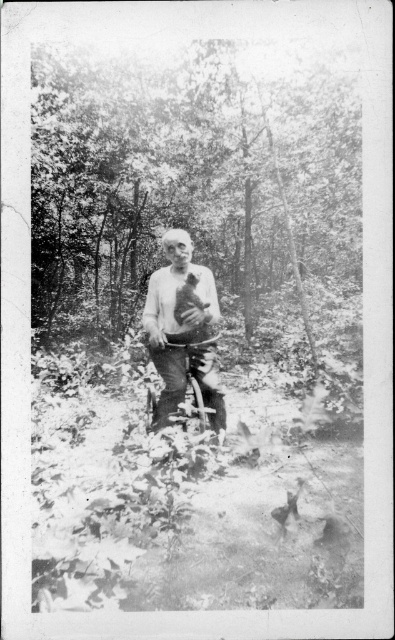
You are standing in the wooded area and see the smooth bark tree at center and the smooth white shirt at center. Which object is located to the right of the other?

The smooth bark tree at center is positioned on the right side of smooth white shirt at center, so the smooth bark tree at center is to the right of the smooth white shirt at center.

You are a photographer trying to capture a clear shot of the smooth white shirt at center. However, the smooth bark tree at center is blocking your view. Can you adjust your position to avoid the obstruction?

The smooth bark tree at center is positioned over the smooth white shirt at center, so moving your camera position downward might allow you to capture the smooth white shirt at center without the obstruction of the tree.

Based on the photo, you are standing in the wooded area shown in the image. You see two points marked as point 1 at coordinates point (x=321, y=104) and point 2 at coordinates point (x=167, y=390). Which point is closer to you?

Point 1 at coordinates point (x=321, y=104) is closer to you because it is further to the viewer than point 2 at coordinates point (x=167, y=390).